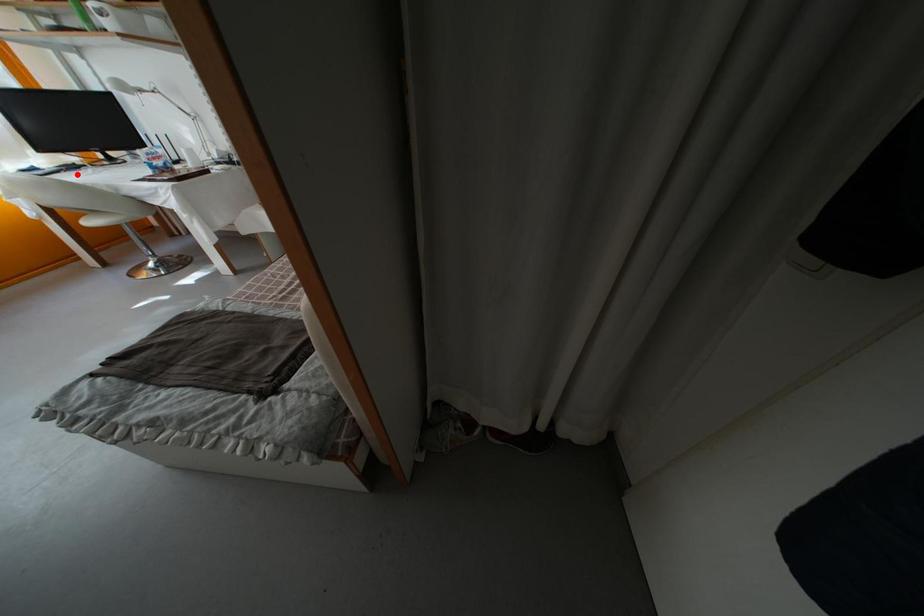
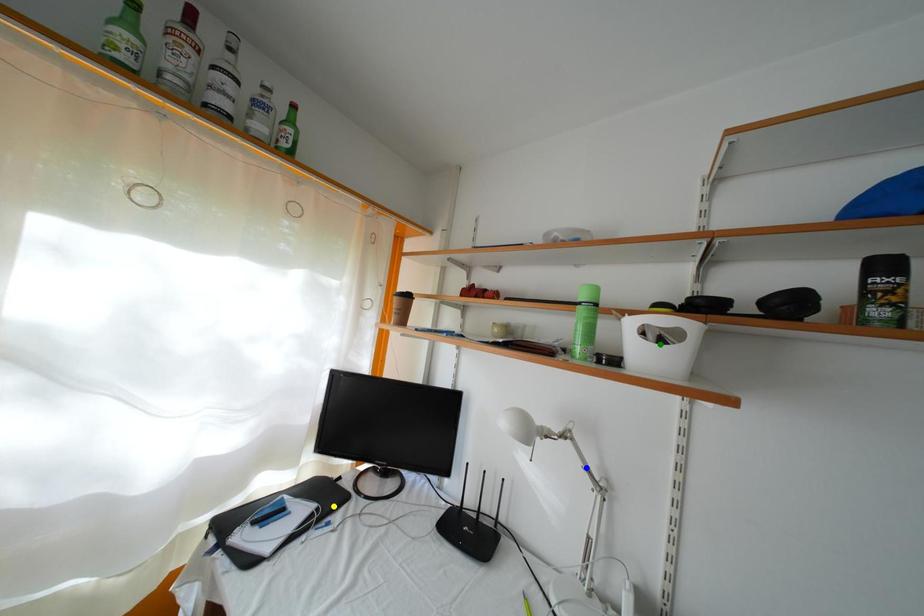
Question: I am providing you with two images of the same scene from different viewpoints. A red point is marked on the first image. You are given multiple points on the second image. Which point in image 2 is actually the same real-world point as the red point in image 1?

Choices:
 (A) yellow point
 (B) green point
 (C) blue point

Answer: (A)